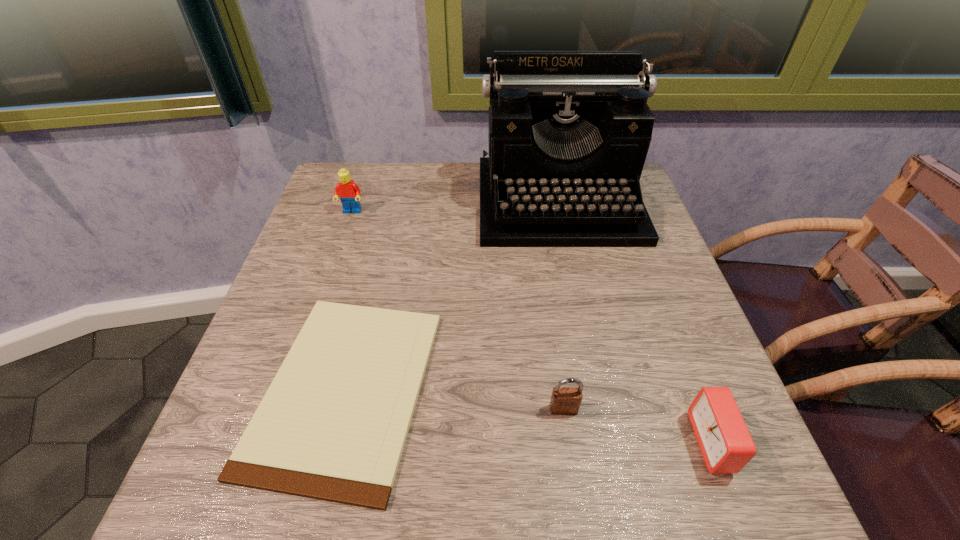
This screenshot has width=960, height=540. Identify the location of typewriter. (569, 131).

Where is `Lego`? The image size is (960, 540). Lego is located at coordinates (349, 193).

What are the coordinates of `padlock` in the screenshot? It's located at pos(564,400).

Find the location of a particular element. alarm clock is located at coordinates (725, 442).

You are a GUI agent. You are given a task and a screenshot of the screen. Output one action in this format:
    pyautogui.click(x=<x>, y=<y>)
    Task: Click on the shortest object
    The image size is (960, 540).
    Given the screenshot: What is the action you would take?
    pyautogui.click(x=332, y=426)

This screenshot has width=960, height=540. I want to click on vacant space located 0.300m on the typing side of the tallest object, so click(591, 356).

Find the location of `vacant region located 0.070m on the face of the fourth shortest object`. vacant region located 0.070m on the face of the fourth shortest object is located at coordinates (345, 234).

Locate an element on the screen. vacant region located on the front-facing side of the padlock is located at coordinates (569, 451).

I want to click on free space located 0.150m on the front-facing side of the alarm clock, so 599,442.

The height and width of the screenshot is (540, 960). Find the location of `free location located 0.050m on the front-facing side of the alarm clock`. free location located 0.050m on the front-facing side of the alarm clock is located at coordinates (663, 442).